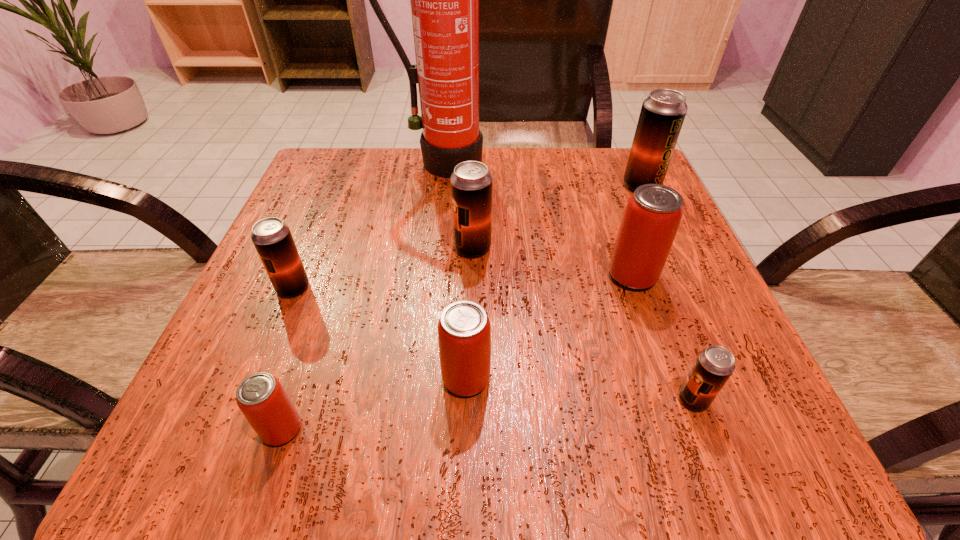
Identify the location of vacant space at the left edge of the desktop. The width and height of the screenshot is (960, 540). [271, 303].

Identify the location of vacant region at the far left corner. The height and width of the screenshot is (540, 960). (315, 168).

Where is `vacant space at the near left corner of the desktop`? vacant space at the near left corner of the desktop is located at coordinates (256, 453).

The width and height of the screenshot is (960, 540). In the image, there is a desktop. Identify the location of vacant area at the far right corner. (619, 196).

Find the location of a particular element. This screenshot has width=960, height=540. vacant space at the near right corner is located at coordinates (704, 469).

This screenshot has height=540, width=960. Find the location of `unoccupied area between the rightmost object and the fire extinguisher`. unoccupied area between the rightmost object and the fire extinguisher is located at coordinates (541, 174).

Identify the location of free space that is in between the second biggest pink beer can and the biggest pink beer can. pos(549,327).

This screenshot has height=540, width=960. I want to click on vacant area that lies between the second biggest pink beer can and the fire extinguisher, so click(x=454, y=271).

What are the coordinates of `vacant point located between the third biggest black beer can and the second nearest pink beer can` in the screenshot? It's located at (379, 333).

Where is `empty space that is in between the biggest pink beer can and the second smallest pink beer can`? This screenshot has width=960, height=540. empty space that is in between the biggest pink beer can and the second smallest pink beer can is located at coordinates (549, 327).